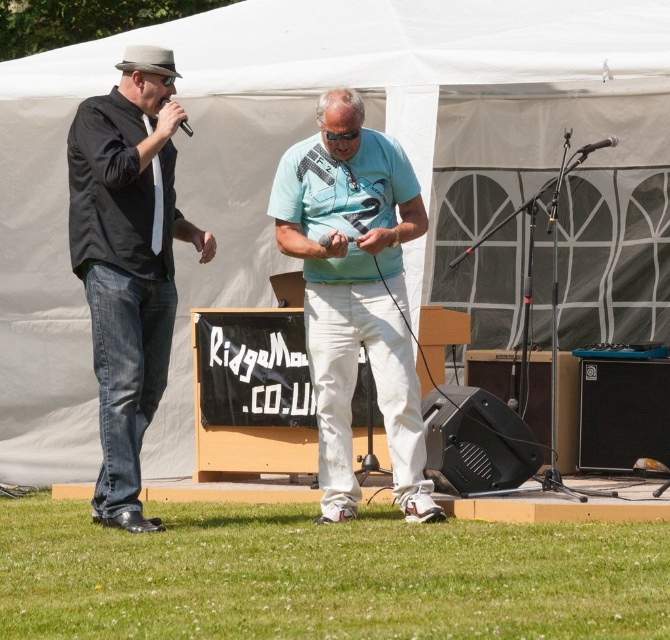
Which of these two, light blue cotton shirt at center or black plastic microphone at upper left, stands taller?

light blue cotton shirt at center is taller.

Does point (395, 189) come closer to viewer compared to point (180, 124)?

That is False.

At what (x,y) coordinates should I click in order to perform the action: click on light blue cotton shirt at center. Please return your answer as a coordinate pair (x, y). Looking at the image, I should click on (354, 292).

Can you confirm if metallic silver microphone at upper right is thinner than black matte microphone at center?

In fact, metallic silver microphone at upper right might be wider than black matte microphone at center.

Is metallic silver microphone at upper right above black matte microphone at center?

Yes.

Which is in front, point (608, 145) or point (326, 236)?

Point (326, 236) is more forward.

The image size is (670, 640). In order to click on metallic silver microphone at upper right in this screenshot , I will do `click(596, 147)`.

Does black matte shirt at left appear on the left side of black plastic microphone at upper left?

Yes, black matte shirt at left is to the left of black plastic microphone at upper left.

Is black matte shirt at left closer to camera compared to black plastic microphone at upper left?

No, it is behind black plastic microphone at upper left.

Image resolution: width=670 pixels, height=640 pixels. In order to click on black matte shirt at left in this screenshot , I will do `click(127, 260)`.